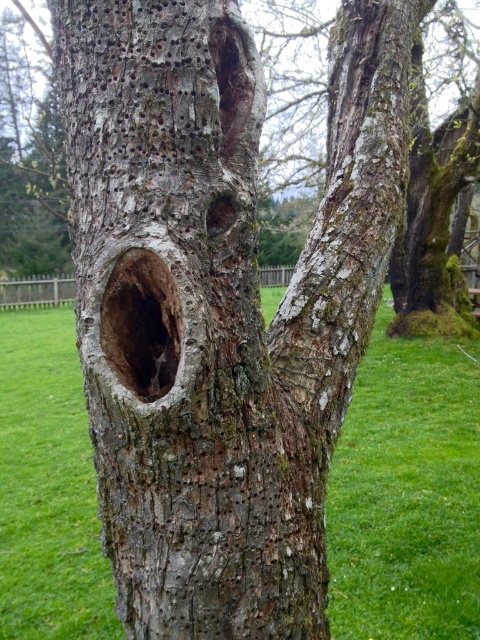
Question: Can you confirm if green mossy bark at upper right is positioned above smooth bark hole at center?

Choices:
 (A) yes
 (B) no

Answer: (A)

Question: Is green grass at center positioned before green mossy bark at upper right?

Choices:
 (A) yes
 (B) no

Answer: (A)

Question: Among these objects, which one is farthest from the camera?

Choices:
 (A) green mossy bark at upper right
 (B) smooth bark hole at center
 (C) green grass at center

Answer: (A)

Question: Estimate the real-world distances between objects in this image. Which object is farther from the green grass at center?

Choices:
 (A) smooth bark hole at center
 (B) green mossy bark at upper right

Answer: (B)

Question: Among these points, which one is farthest from the camera?

Choices:
 (A) (x=456, y=308)
 (B) (x=19, y=419)

Answer: (A)

Question: Does green grass at center lie behind green mossy bark at upper right?

Choices:
 (A) no
 (B) yes

Answer: (A)